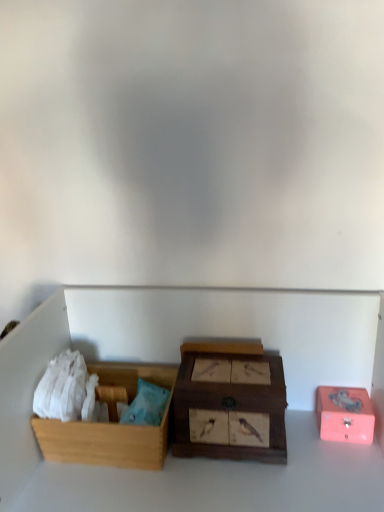
Question: From a real-world perspective, is wooden box with bird pictures at center, positioned as the 2th box in right-to-left order, positioned under wooden box at left, placed as the 3th box when sorted from right to left, based on gravity?

Choices:
 (A) no
 (B) yes

Answer: (A)

Question: Considering the relative positions of wooden box with bird pictures at center, which appears as the 2th box when viewed from the left, and wooden box at left, positioned as the first box in left-to-right order, in the image provided, is wooden box with bird pictures at center, which appears as the 2th box when viewed from the left, behind wooden box at left, positioned as the first box in left-to-right order,?

Choices:
 (A) yes
 (B) no

Answer: (B)

Question: Would you say wooden box at left, placed as the 3th box when sorted from right to left, is part of wooden box with bird pictures at center, positioned as the 2th box in right-to-left order,'s contents?

Choices:
 (A) no
 (B) yes

Answer: (A)

Question: Considering the relative sizes of wooden box with bird pictures at center, positioned as the 2th box in right-to-left order, and wooden box at left, positioned as the first box in left-to-right order, in the image provided, is wooden box with bird pictures at center, positioned as the 2th box in right-to-left order, smaller than wooden box at left, positioned as the first box in left-to-right order,?

Choices:
 (A) no
 (B) yes

Answer: (A)

Question: Can you confirm if wooden box with bird pictures at center, positioned as the 2th box in right-to-left order, is wider than wooden box at left, placed as the 3th box when sorted from right to left?

Choices:
 (A) yes
 (B) no

Answer: (B)

Question: Is the position of wooden box with bird pictures at center, which appears as the 2th box when viewed from the left, less distant than that of wooden box at left, positioned as the first box in left-to-right order?

Choices:
 (A) no
 (B) yes

Answer: (B)

Question: Does wooden box at left, placed as the 3th box when sorted from right to left, turn towards wooden box with bird pictures at center, positioned as the 2th box in right-to-left order?

Choices:
 (A) no
 (B) yes

Answer: (A)

Question: Are wooden box at left, placed as the 3th box when sorted from right to left, and wooden box with bird pictures at center, which appears as the 2th box when viewed from the left, beside each other?

Choices:
 (A) yes
 (B) no

Answer: (B)

Question: Considering the relative positions of wooden box at left, placed as the 3th box when sorted from right to left, and wooden box with bird pictures at center, which appears as the 2th box when viewed from the left, in the image provided, is wooden box at left, placed as the 3th box when sorted from right to left, to the right of wooden box with bird pictures at center, which appears as the 2th box when viewed from the left, from the viewer's perspective?

Choices:
 (A) yes
 (B) no

Answer: (B)

Question: From a real-world perspective, is wooden box at left, placed as the 3th box when sorted from right to left, on top of wooden box with bird pictures at center, which appears as the 2th box when viewed from the left?

Choices:
 (A) no
 (B) yes

Answer: (A)

Question: Does wooden box at left, placed as the 3th box when sorted from right to left, have a larger size compared to wooden box with bird pictures at center, positioned as the 2th box in right-to-left order?

Choices:
 (A) no
 (B) yes

Answer: (A)

Question: Is wooden box at left, placed as the 3th box when sorted from right to left, to the left of wooden box with bird pictures at center, which appears as the 2th box when viewed from the left, from the viewer's perspective?

Choices:
 (A) no
 (B) yes

Answer: (B)

Question: Is pink matte box at right, arranged as the 3th box when viewed from the left, turned away from wooden box with bird pictures at center, which appears as the 2th box when viewed from the left?

Choices:
 (A) no
 (B) yes

Answer: (A)